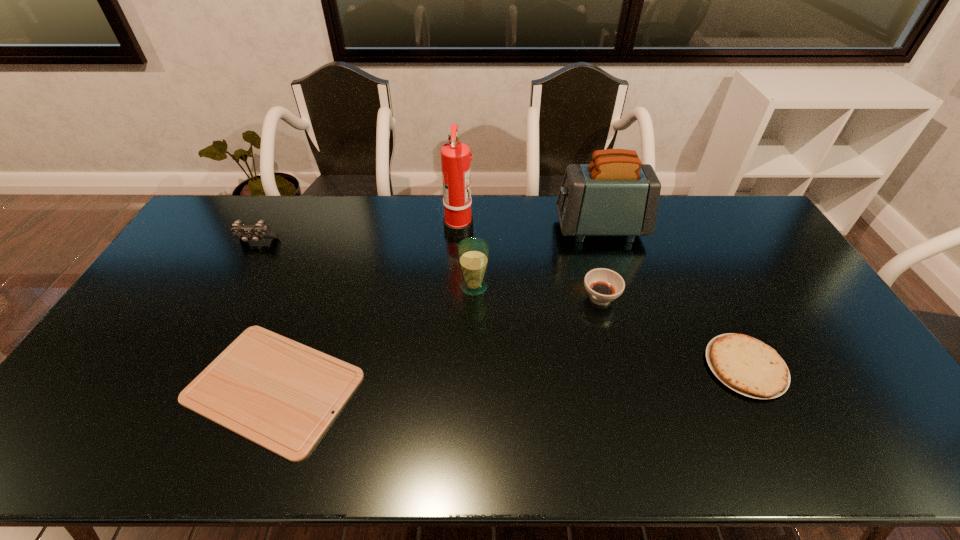
At what (x,y) coordinates should I click in order to perform the action: click on vacant area in the image that satisfies the following two spatial constraints: 1. at the nozzle of the fire extinguisher; 2. on the right side of the fifth shortest object. Please return your answer as a coordinate pair (x, y). Image resolution: width=960 pixels, height=540 pixels. Looking at the image, I should click on (455, 287).

At what (x,y) coordinates should I click in order to perform the action: click on vacant space that satisfies the following two spatial constraints: 1. at the nozzle of the tallest object; 2. on the right side of the third shortest object. Please return your answer as a coordinate pair (x, y). Looking at the image, I should click on (455, 298).